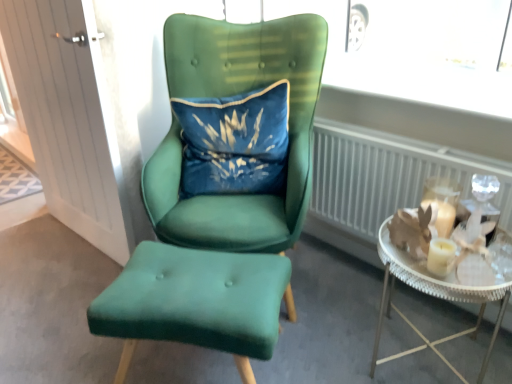
Question: Is velvet blue pillow at center shorter than velvet green ottoman at center, positioned as the second chair in top-to-bottom order?

Choices:
 (A) yes
 (B) no

Answer: (B)

Question: From the image's perspective, is velvet blue pillow at center below velvet green ottoman at center, the first chair ordered from the bottom?

Choices:
 (A) yes
 (B) no

Answer: (B)

Question: From the image's perspective, is velvet blue pillow at center above velvet green ottoman at center, the first chair ordered from the bottom?

Choices:
 (A) no
 (B) yes

Answer: (B)

Question: Is velvet blue pillow at center to the left of velvet green ottoman at center, positioned as the second chair in top-to-bottom order, from the viewer's perspective?

Choices:
 (A) no
 (B) yes

Answer: (A)

Question: Considering the relative sizes of velvet blue pillow at center and velvet green ottoman at center, positioned as the second chair in top-to-bottom order, in the image provided, is velvet blue pillow at center wider than velvet green ottoman at center, positioned as the second chair in top-to-bottom order,?

Choices:
 (A) no
 (B) yes

Answer: (A)

Question: From a real-world perspective, is velvet blue pillow at center physically above velvet green ottoman at center, the first chair ordered from the bottom?

Choices:
 (A) no
 (B) yes

Answer: (B)

Question: Is the surface of velvet green chair at center, positioned as the first chair in top-to-bottom order, in direct contact with white metallic radiator at right?

Choices:
 (A) no
 (B) yes

Answer: (A)

Question: Does velvet green chair at center, which appears as the second chair when ordered from the bottom, have a lesser height compared to white metallic radiator at right?

Choices:
 (A) yes
 (B) no

Answer: (B)

Question: Can you confirm if velvet green chair at center, positioned as the first chair in top-to-bottom order, is wider than white metallic radiator at right?

Choices:
 (A) yes
 (B) no

Answer: (A)

Question: Is velvet green chair at center, positioned as the first chair in top-to-bottom order, outside of white metallic radiator at right?

Choices:
 (A) yes
 (B) no

Answer: (A)

Question: Can you confirm if velvet green chair at center, which appears as the second chair when ordered from the bottom, is positioned to the right of white metallic radiator at right?

Choices:
 (A) yes
 (B) no

Answer: (B)

Question: Does velvet green chair at center, positioned as the first chair in top-to-bottom order, have a smaller size compared to white metallic radiator at right?

Choices:
 (A) yes
 (B) no

Answer: (B)

Question: Is white wood door at left further to the viewer compared to metallic silver tray at right?

Choices:
 (A) yes
 (B) no

Answer: (A)